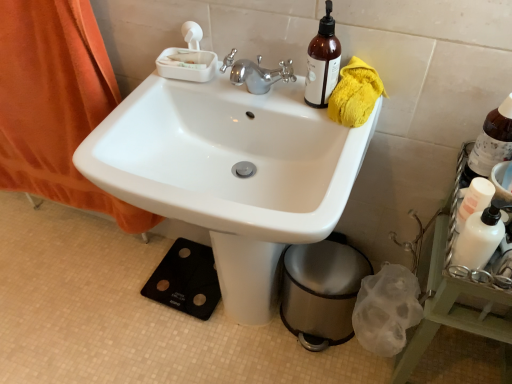
Question: From a real-world perspective, is white glossy sink at center physically located above or below orange fabric curtain at left?

Choices:
 (A) below
 (B) above

Answer: (A)

Question: Considering the positions of white glossy sink at center and orange fabric curtain at left in the image, is white glossy sink at center wider or thinner than orange fabric curtain at left?

Choices:
 (A) wide
 (B) thin

Answer: (A)

Question: Estimate the real-world distances between objects in this image. Which object is farther from the brown glass bottle at upper right, the second bottle in the bottom-to-top sequence?

Choices:
 (A) white glossy sink at center
 (B) brown glass bottle at upper right, which is counted as the third bottle, starting from the bottom
 (C) orange fabric curtain at left
 (D) white matte bottle at right
 (E) metallic trash can at lower right

Answer: (C)

Question: Which object is positioned closest to the brown glass bottle at upper right, marked as the third bottle in a right-to-left arrangement?

Choices:
 (A) white glossy lotion at right, the second bottle positioned from the right
 (B) white matte bottle at right
 (C) metallic trash can at lower right
 (D) brown glass bottle at upper right, which is the 1th bottle in right-to-left order
 (E) white glossy sink at center

Answer: (E)